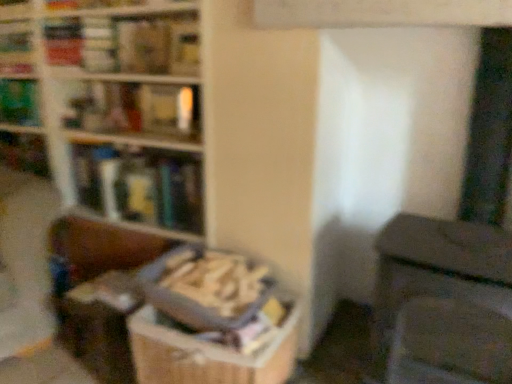
Question: From the image's perspective, is hardcover book at upper left, placed as the third book when sorted from bottom to top, positioned above or below green matte book at upper left, the fourth book from the bottom?

Choices:
 (A) below
 (B) above

Answer: (A)

Question: Is hardcover book at upper left, which is counted as the third book, starting from the top, bigger or smaller than green matte book at upper left, which is counted as the second book, starting from the top?

Choices:
 (A) small
 (B) big

Answer: (A)

Question: Estimate the real-world distances between objects in this image. Which object is farther from the wooden textured book at center, which ranks as the 1th book in bottom-to-top order?

Choices:
 (A) hardcover book at upper center, arranged as the 5th book when ordered from the bottom
 (B) hardcover book at upper left, placed as the third book when sorted from bottom to top
 (C) wooden bookcase at upper left
 (D) hardcover book at left, placed as the second book when sorted from bottom to top
 (E) green matte book at upper left, the fourth book from the bottom

Answer: (E)

Question: Which object is the closest to the wooden textured book at center, placed as the fifth book when sorted from top to bottom?

Choices:
 (A) hardcover book at upper center, arranged as the 5th book when ordered from the bottom
 (B) wooden bookcase at upper left
 (C) hardcover book at upper left, placed as the third book when sorted from bottom to top
 (D) green matte book at upper left, the fourth book from the bottom
 (E) hardcover book at left, placed as the second book when sorted from bottom to top

Answer: (E)